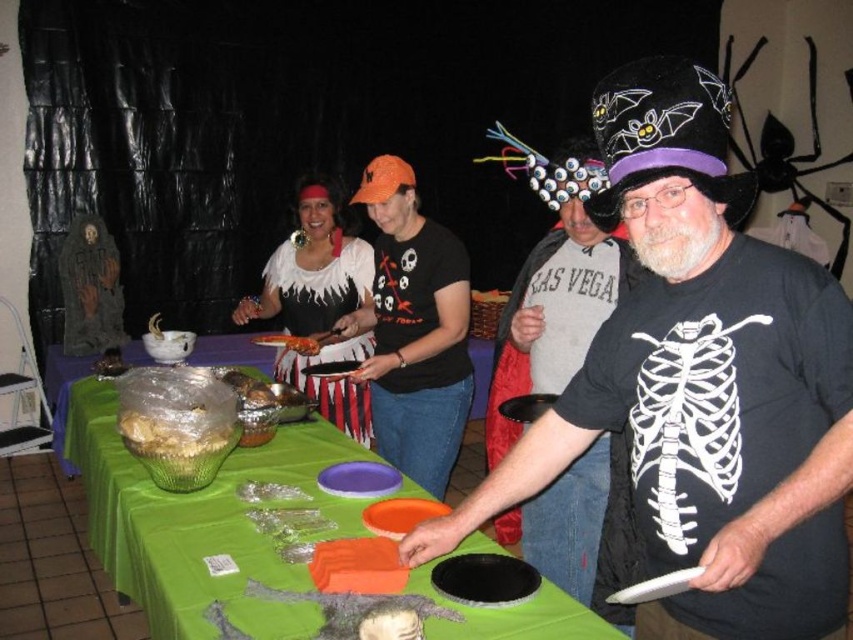
Question: Which of the following is the closest to the observer?

Choices:
 (A) white matte dress at center
 (B) black matte skeleton shirt at center
 (C) matte black skeleton shirt at center

Answer: (B)

Question: Among these points, which one is nearest to the camera?

Choices:
 (A) (558, 296)
 (B) (300, 314)

Answer: (A)

Question: Based on their relative distances, which object is nearer to the black matte skeleton shirt at center?

Choices:
 (A) black matte t-shirt at center
 (B) orange glossy hot dog at center
 (C) white matte dress at center

Answer: (A)

Question: Does green fabric table at lower left have a lesser width compared to orange glossy hot dog at center?

Choices:
 (A) yes
 (B) no

Answer: (B)

Question: Can you confirm if black matte skeleton shirt at center is thinner than green fabric table at lower left?

Choices:
 (A) no
 (B) yes

Answer: (B)

Question: Is matte black skeleton shirt at center above black matte t-shirt at center?

Choices:
 (A) no
 (B) yes

Answer: (A)